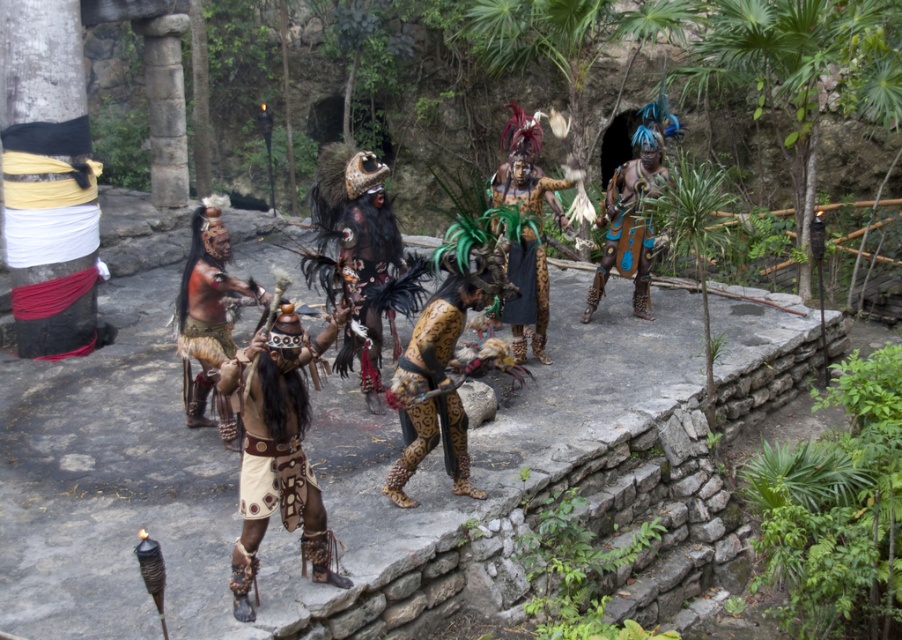
How much distance is there between blue painted skin at center and leopard print skirt at center?

They are 1.35 meters apart.

Who is more forward, (609, 220) or (536, 280)?

Positioned in front is point (536, 280).

Find the location of a particular element. The height and width of the screenshot is (640, 902). blue painted skin at center is located at coordinates (631, 216).

Which is above, leopard print leggings at center or matte brown leather armor at center?

matte brown leather armor at center is above.

Is point (462, 416) in front of point (191, 344)?

Yes, point (462, 416) is closer to viewer.

What are the coordinates of `leopard print leggings at center` in the screenshot? It's located at (440, 371).

Find the location of `leopard print leggings at center`. leopard print leggings at center is located at coordinates (440, 371).

From the picture: Who is taller, leather-like beige skirt at center or leopard print skirt at center?

Standing taller between the two is leather-like beige skirt at center.

Is leather-like beige skirt at center to the left of leopard print skirt at center from the viewer's perspective?

Correct, you'll find leather-like beige skirt at center to the left of leopard print skirt at center.

Is point (264, 387) less distant than point (551, 189)?

Yes, it is in front of point (551, 189).

At what (x,y) coordinates should I click in order to perform the action: click on leather-like beige skirt at center. Please return your answer as a coordinate pair (x, y). The width and height of the screenshot is (902, 640). Looking at the image, I should click on (277, 449).